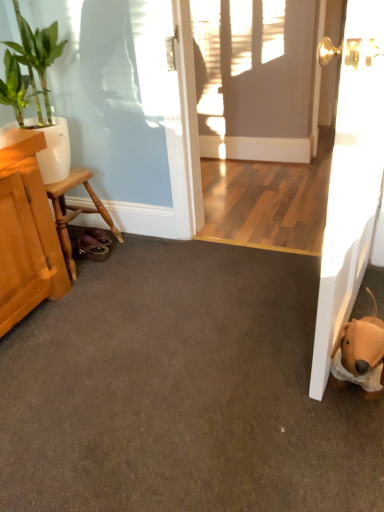
This screenshot has height=512, width=384. Identify the location of vacant space to the right of wooden stool at left. (144, 260).